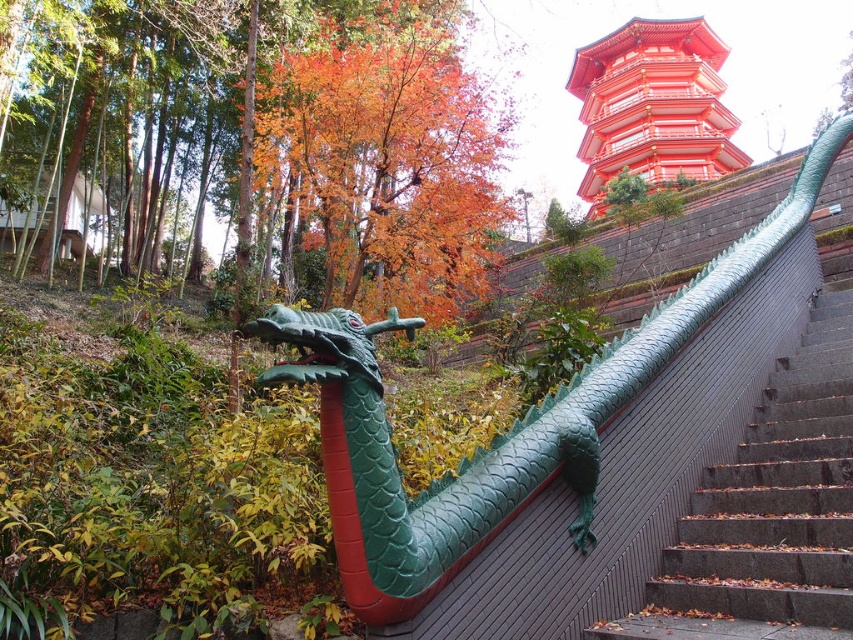
Question: Where is green matte dragon at center located in relation to shiny lacquered pagoda at upper right in the image?

Choices:
 (A) right
 (B) left

Answer: (B)

Question: Can you confirm if green scaly dragon at upper center is positioned above shiny lacquered pagoda at upper right?

Choices:
 (A) no
 (B) yes

Answer: (A)

Question: Which point appears closest to the camera in this image?

Choices:
 (A) (743, 449)
 (B) (689, 157)
 (C) (444, 566)
 (D) (387, 435)

Answer: (C)

Question: Which point appears farthest from the camera in this image?

Choices:
 (A) (683, 92)
 (B) (422, 522)
 (C) (815, 486)

Answer: (A)

Question: Which of the following is the closest to the observer?

Choices:
 (A) green scaly dragon at upper center
 (B) gray concrete stairs at lower right

Answer: (B)

Question: Does green scaly dragon at upper center have a larger size compared to gray concrete stairs at lower right?

Choices:
 (A) yes
 (B) no

Answer: (B)